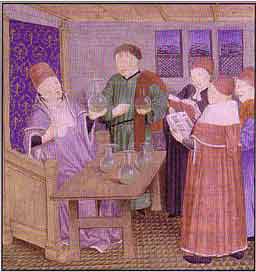
At what (x,y) coordinates should I click in order to perform the action: click on table. Please return your answer as a coordinate pair (x, y). This screenshot has height=272, width=256. Looking at the image, I should click on (98, 190).